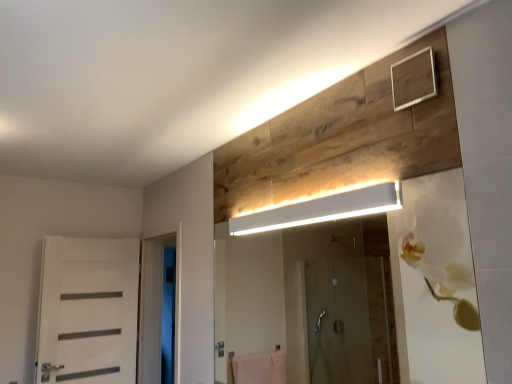
Question: Relative to white glossy door at left, is white matte rectangular light fixture at upper center in front or behind?

Choices:
 (A) behind
 (B) front

Answer: (B)

Question: Considering the positions of white matte rectangular light fixture at upper center and white glossy door at left in the image, is white matte rectangular light fixture at upper center taller or shorter than white glossy door at left?

Choices:
 (A) short
 (B) tall

Answer: (A)

Question: Estimate the real-world distances between objects in this image. Which object is farther from the white matte rectangular light fixture at upper center?

Choices:
 (A) white glossy door at left
 (B) white matte door at left

Answer: (A)

Question: Based on their relative distances, which object is nearer to the white matte door at left?

Choices:
 (A) white matte rectangular light fixture at upper center
 (B) white glossy door at left

Answer: (B)